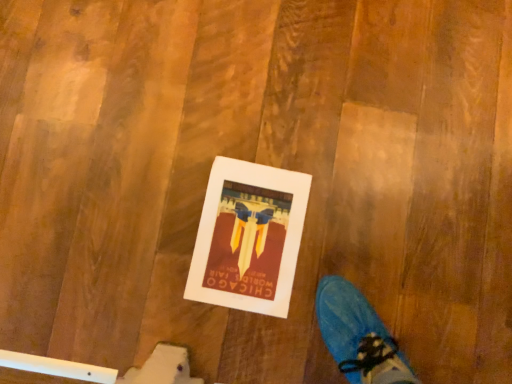
Measure the distance between matte paper postcard at center and camera.

32.83 inches.

Locate an element on the screen. This screenshot has width=512, height=384. matte paper postcard at center is located at coordinates (249, 237).

What do you see at coordinates (249, 237) in the screenshot? I see `matte paper postcard at center` at bounding box center [249, 237].

Image resolution: width=512 pixels, height=384 pixels. What are the coordinates of `matte paper postcard at center` in the screenshot? It's located at (249, 237).